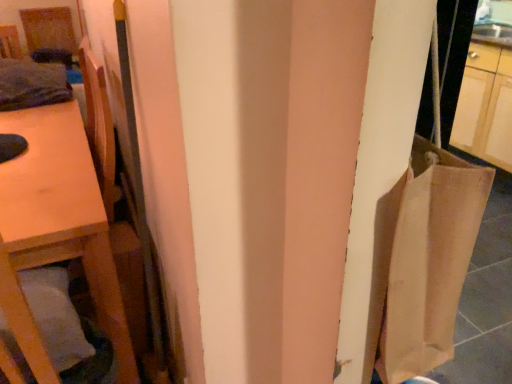
Question: From the image's perspective, is wooden table at left above or below white soft pillow at lower left?

Choices:
 (A) below
 (B) above

Answer: (B)

Question: Which is correct: wooden table at left is inside white soft pillow at lower left, or outside of it?

Choices:
 (A) outside
 (B) inside

Answer: (A)

Question: Which is farther from the wooden chair at left?

Choices:
 (A) wooden table at left
 (B) white soft pillow at lower left

Answer: (B)

Question: Based on their relative distances, which object is nearer to the white soft pillow at lower left?

Choices:
 (A) wooden table at left
 (B) wooden chair at left

Answer: (A)